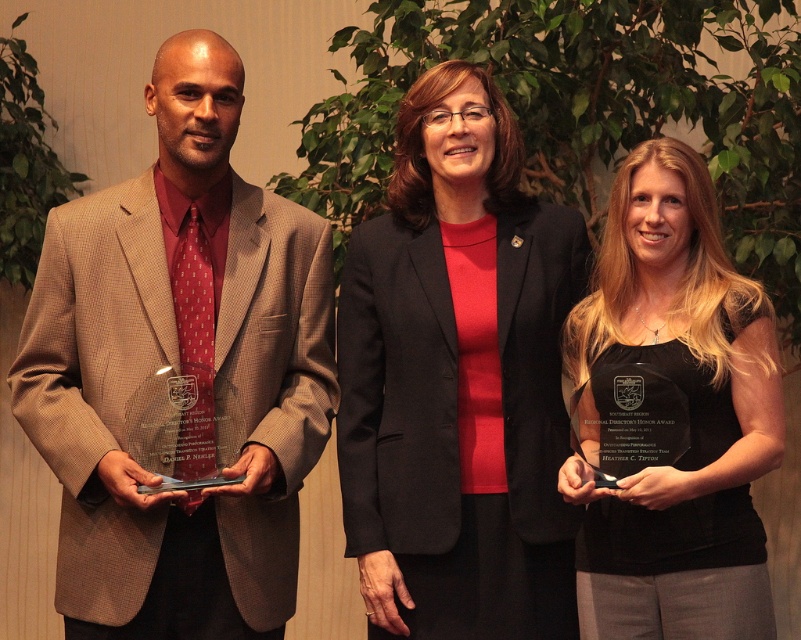
Question: Which of these objects is positioned farthest from the matte brown suit at center?

Choices:
 (A) black glossy award at center
 (B) matte black blazer at center

Answer: (A)

Question: Can you confirm if matte brown suit at center is positioned above matte black blazer at center?

Choices:
 (A) yes
 (B) no

Answer: (A)

Question: Which point appears closest to the camera in this image?

Choices:
 (A) (604, 616)
 (B) (477, 316)
 (C) (127, 314)

Answer: (A)

Question: Is matte black blazer at center to the left of black glossy award at center from the viewer's perspective?

Choices:
 (A) no
 (B) yes

Answer: (B)

Question: Estimate the real-world distances between objects in this image. Which object is farther from the black glossy award at center?

Choices:
 (A) matte black blazer at center
 (B) matte brown suit at center

Answer: (B)

Question: Does matte black blazer at center appear on the left side of black glossy award at center?

Choices:
 (A) yes
 (B) no

Answer: (A)